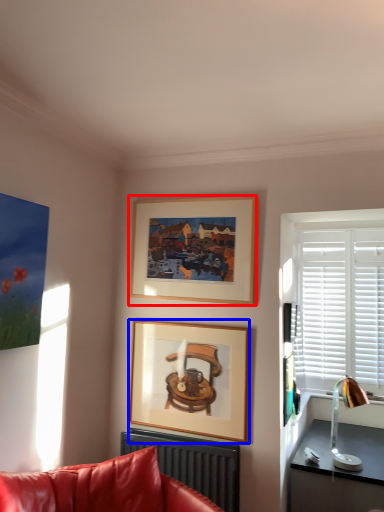
Question: Which object is further to the camera taking this photo, picture frame (highlighted by a red box) or picture frame (highlighted by a blue box)?

Choices:
 (A) picture frame
 (B) picture frame

Answer: (A)